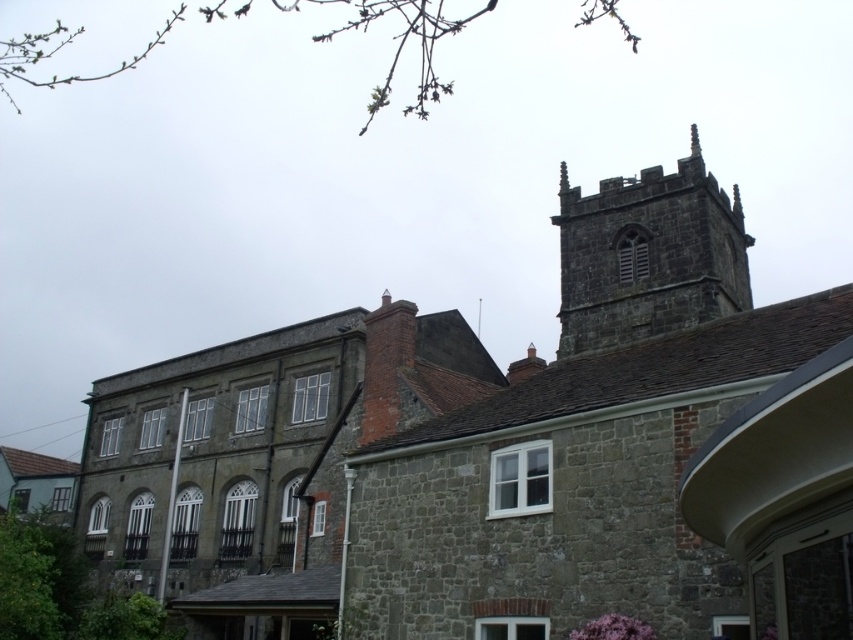
Question: Does dark stone church at upper center appear under dark stone tower at upper right?

Choices:
 (A) yes
 (B) no

Answer: (A)

Question: Is dark stone church at upper center behind dark stone tower at upper right?

Choices:
 (A) no
 (B) yes

Answer: (A)

Question: Where is dark stone church at upper center located in relation to dark stone tower at upper right in the image?

Choices:
 (A) below
 (B) above

Answer: (A)

Question: Which object is closer to the camera taking this photo?

Choices:
 (A) dark stone tower at upper right
 (B) dark stone church at upper center

Answer: (B)